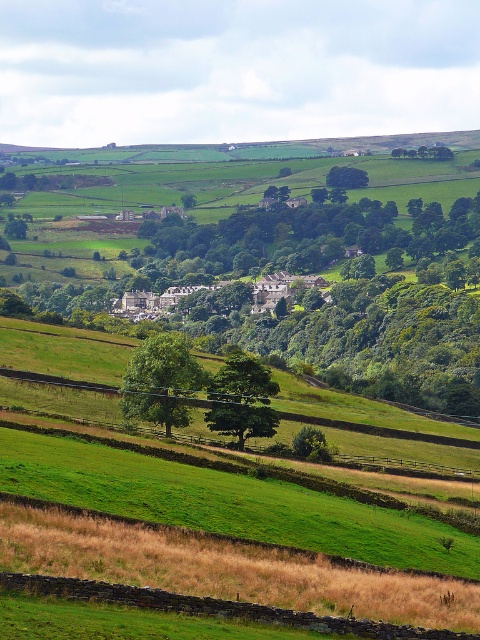
You are standing at the viewing point overlooking the rural landscape. You want to walk down to the stone houses at center. Considering the distance, is it feasible to walk there in 10 minutes?

The stone houses at center are 1978.31 feet away from you. Walking at an average pace of 3 feet per second, it would take approximately 660 seconds or 11 minutes to reach them. Therefore, it is not feasible to walk there in 10 minutes.

You are standing at the point marked by the coordinates point (x=162, y=380) in the image. Looking around, what do you see immediately in front of you?

You are standing at the point marked by the coordinates point (x=162, y=380), which marks green leafy tree at lower center. Immediately in front of you is the green leafy tree at lower center.